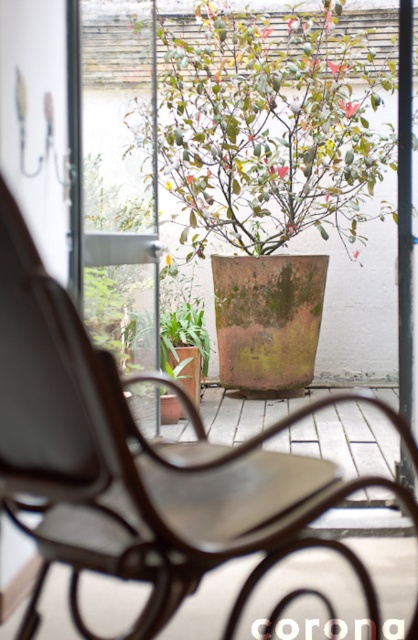
Question: Is rustic wood rocking chair at center positioned before green matte pot at center?

Choices:
 (A) no
 (B) yes

Answer: (B)

Question: Which of the following is the farthest from the observer?

Choices:
 (A) (50, 340)
 (B) (367, 56)

Answer: (B)

Question: Which object appears farthest from the camera in this image?

Choices:
 (A) green matte pot at center
 (B) rustic wood rocking chair at center

Answer: (A)

Question: Which of the following is the closest to the observer?

Choices:
 (A) (229, 81)
 (B) (313, 470)

Answer: (B)

Question: Does rustic wood rocking chair at center appear on the left side of green matte pot at center?

Choices:
 (A) yes
 (B) no

Answer: (A)

Question: Is rustic wood rocking chair at center to the right of green matte pot at center from the viewer's perspective?

Choices:
 (A) yes
 (B) no

Answer: (B)